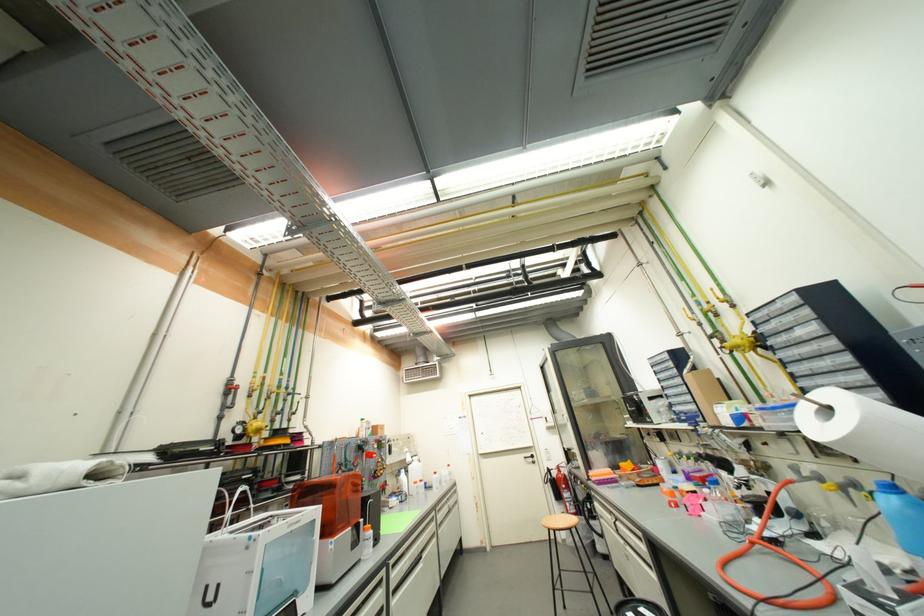
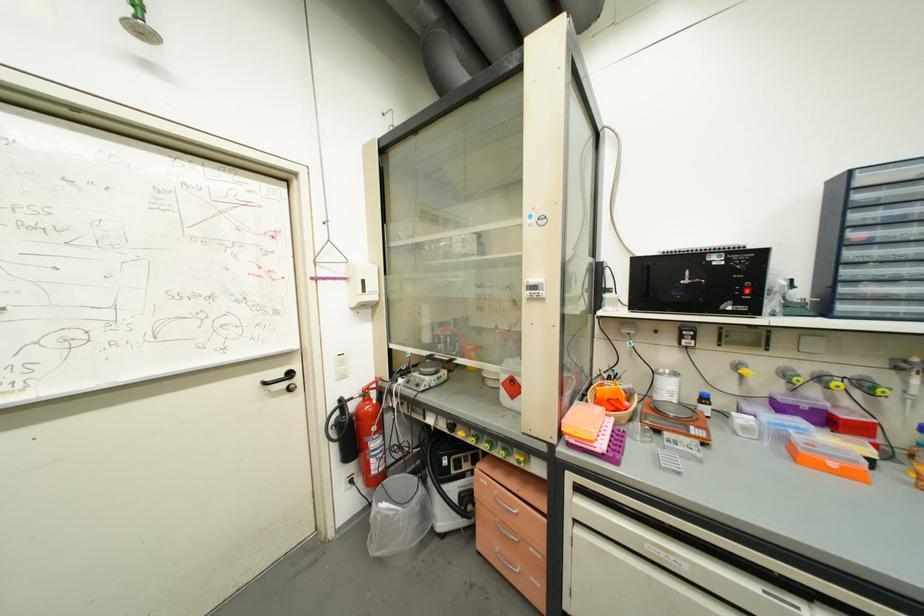
Where in the second image is the point corresponding to pixel 653 422 from the first image?

(735, 310)